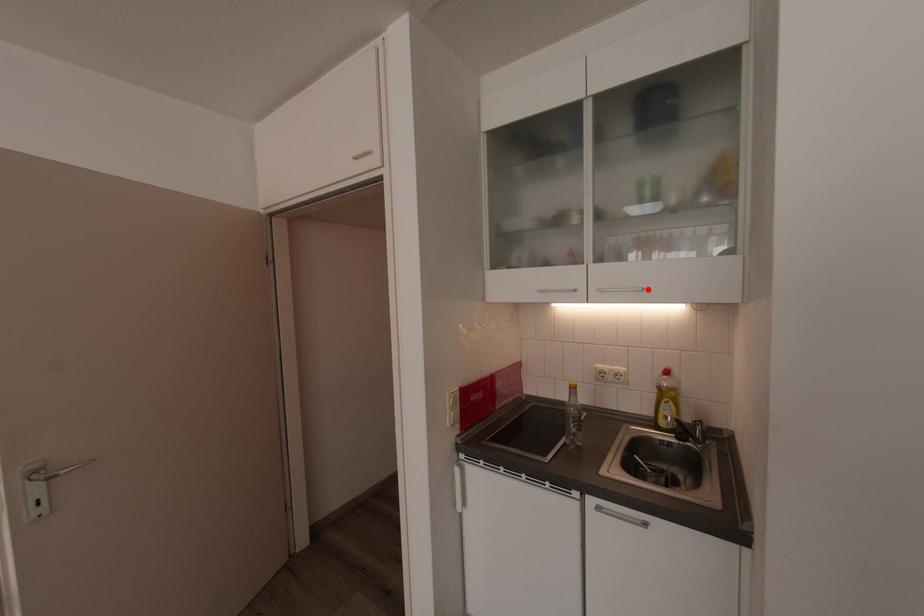
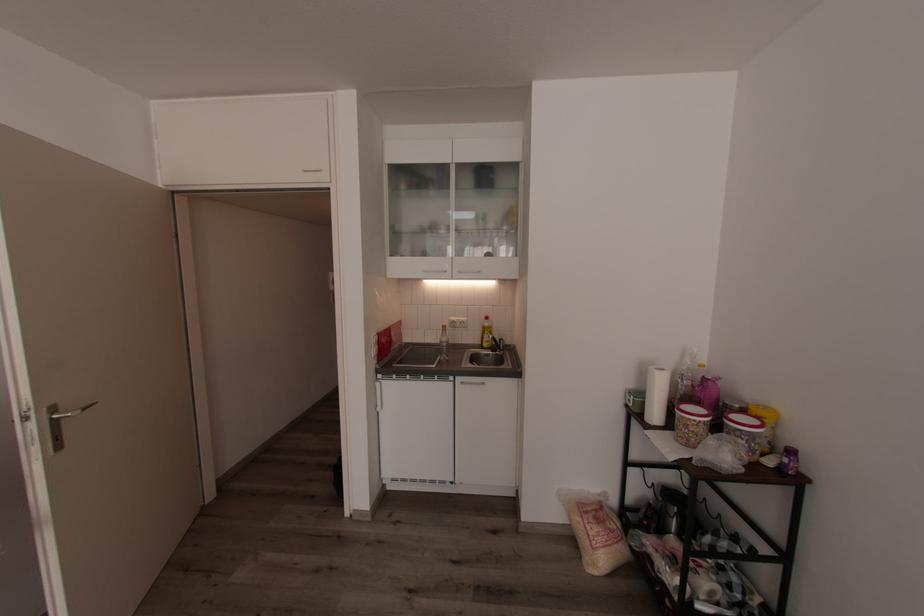
Locate, in the second image, the point that corresponds to the highlighted location in the first image.

(484, 272)